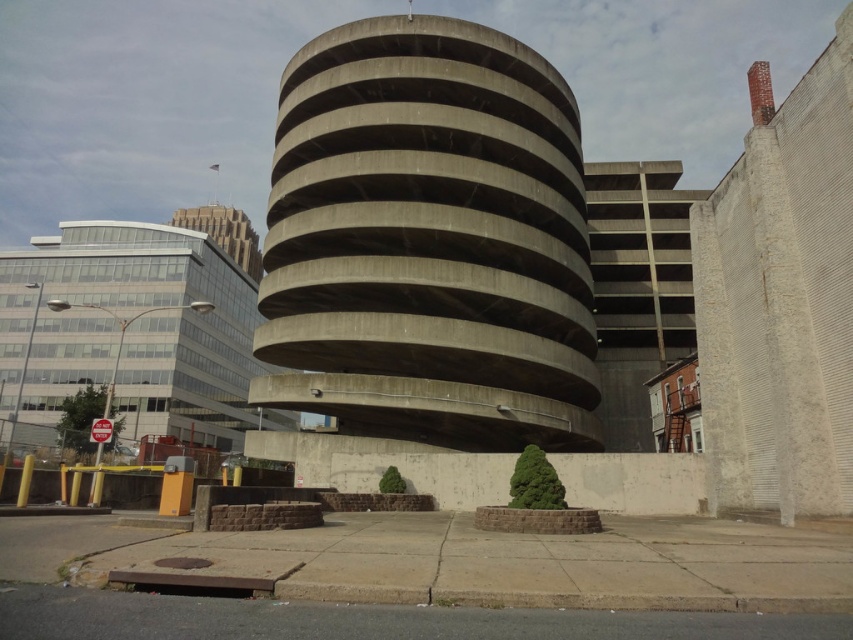
Is concrete building at left smaller than glass/metal skyscraper at upper left?

Actually, concrete building at left might be larger than glass/metal skyscraper at upper left.

Is point (115, 285) less distant than point (200, 225)?

Yes, it is in front of point (200, 225).

Where is `concrete building at left`? concrete building at left is located at coordinates (134, 332).

Between white brick wall at right and concrete parking garage at right, which one has less height?

white brick wall at right is shorter.

Who is positioned more to the left, white brick wall at right or concrete parking garage at right?

white brick wall at right is more to the left.

Which is in front, point (727, 227) or point (664, 186)?

Point (727, 227) is in front.

Where is `white brick wall at right`? The width and height of the screenshot is (853, 640). white brick wall at right is located at coordinates (781, 304).

Can you confirm if concrete at center is positioned to the left of concrete building at left?

Incorrect, concrete at center is not on the left side of concrete building at left.

Can you confirm if concrete at center is positioned below concrete building at left?

No.

Describe the element at coordinates (428, 241) in the screenshot. I see `concrete at center` at that location.

You are a GUI agent. You are given a task and a screenshot of the screen. Output one action in this format:
    pyautogui.click(x=<x>, y=<y>)
    Task: Click on the concrete at center
    Image resolution: width=853 pixels, height=640 pixels.
    Given the screenshot: What is the action you would take?
    pyautogui.click(x=428, y=241)